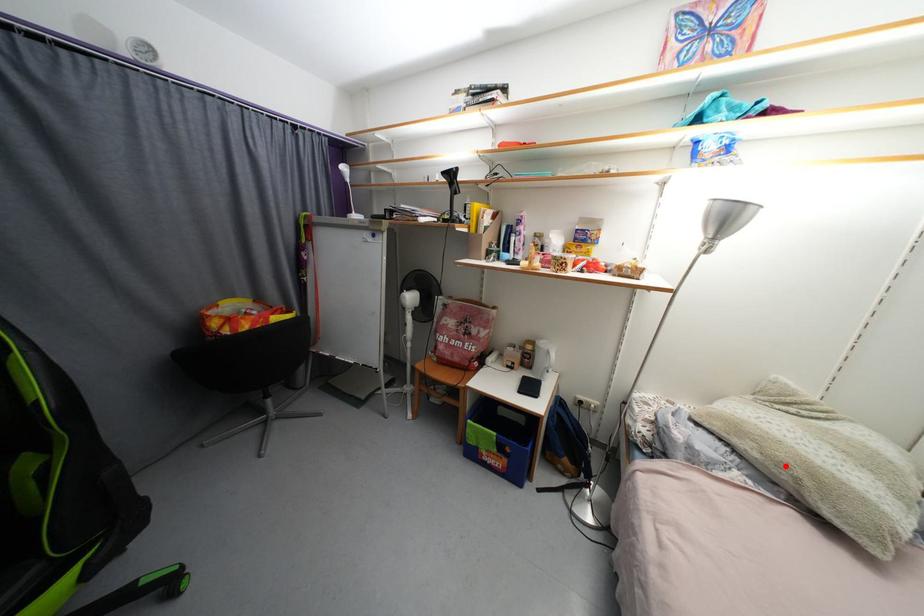
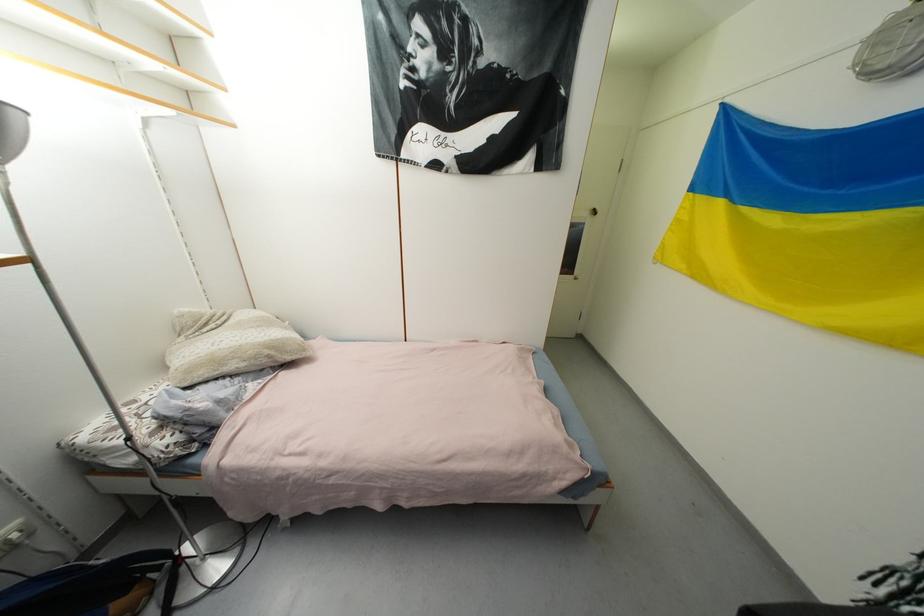
Question: I am providing you with two images of the same scene from different viewpoints. Image1 has a red point marked. In image2, the corresponding 3D location appears at what relative position? Reply with the corresponding letter.

Choices:
 (A) Closer
 (B) Farther

Answer: (A)